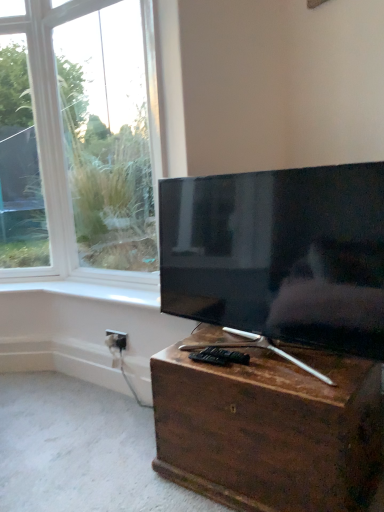
Find the location of a particular element. Image resolution: width=384 pixels, height=512 pixels. vacant region under matte black tv at center (from a real-world perspective) is located at coordinates (262, 358).